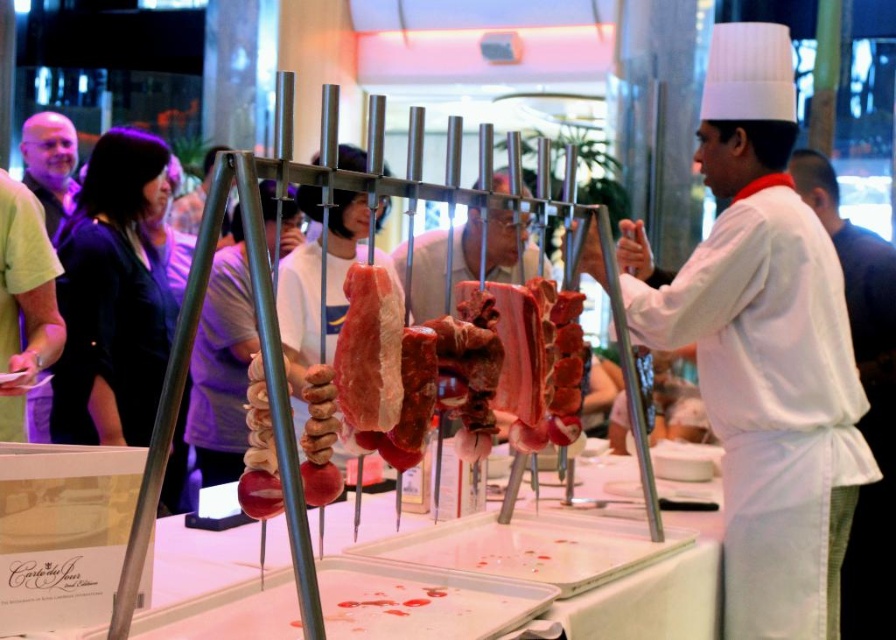
Question: Among these objects, which one is nearest to the camera?

Choices:
 (A) pink raw meat at center
 (B) raw meat at center
 (C) white chef's uniform at center

Answer: (A)

Question: Which point is closer to the camera taking this photo?

Choices:
 (A) (742, 150)
 (B) (362, 264)

Answer: (B)

Question: Can you confirm if white chef's uniform at center is positioned to the right of pink raw meat at center?

Choices:
 (A) no
 (B) yes

Answer: (B)

Question: Is raw meat at center to the right of pink raw meat at center from the viewer's perspective?

Choices:
 (A) yes
 (B) no

Answer: (A)

Question: Which of these objects is positioned farthest from the pink raw meat at center?

Choices:
 (A) white chef's uniform at center
 (B) raw meat at center

Answer: (B)

Question: Is white chef's uniform at center positioned at the back of pink raw meat at center?

Choices:
 (A) yes
 (B) no

Answer: (A)